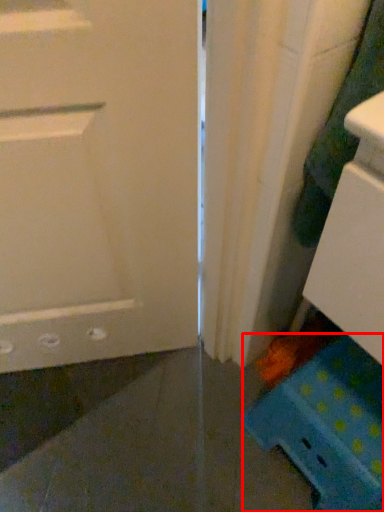
Question: From the image's perspective, what is the correct spatial relationship of cabinetry (annotated by the red box) in relation to laundry?

Choices:
 (A) above
 (B) below

Answer: (B)